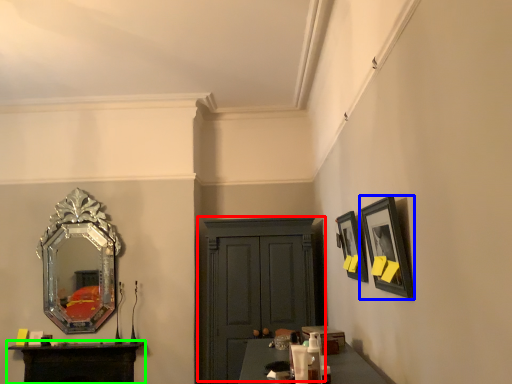
Question: Estimate the real-world distances between objects in this image. Which object is farther from cabinetry (highlighted by a red box), picture frame (highlighted by a blue box) or table (highlighted by a green box)?

Choices:
 (A) picture frame
 (B) table

Answer: (A)